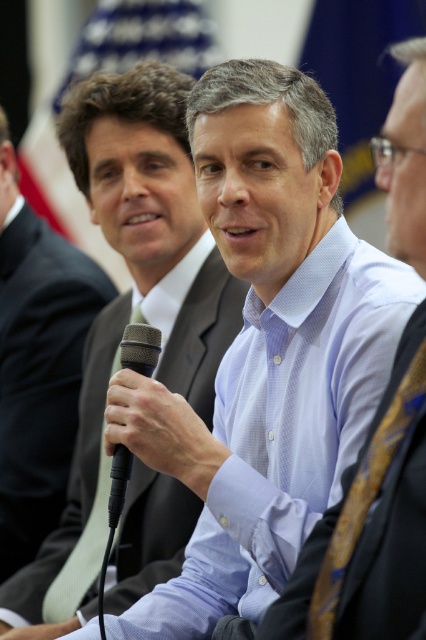
Which is behind, point (34, 509) or point (157, 352)?

Positioned behind is point (34, 509).

Between matte black microphone at center and black matte microphone at center, which one is positioned higher?

Positioned higher is matte black microphone at center.

Between point (45, 516) and point (120, 470), which one is positioned behind?

The point (45, 516) is behind.

You are a GUI agent. You are given a task and a screenshot of the screen. Output one action in this format:
    pyautogui.click(x=<x>, y=<y>)
    Task: Click on the matte black microphone at center
    
    Given the screenshot: What is the action you would take?
    (x=37, y=364)

Can you confirm if dark gray suit at center is positioned to the right of matte black microphone at center?

Correct, you'll find dark gray suit at center to the right of matte black microphone at center.

Is point (46, 554) positioned before point (42, 540)?

Yes, it is.

Which is in front, point (206, 310) or point (49, 396)?

Point (206, 310) is in front.

The width and height of the screenshot is (426, 640). Find the location of `dark gray suit at center`. dark gray suit at center is located at coordinates click(195, 326).

Which is more to the left, light blue textured shirt at center or matte black microphone at center?

From the viewer's perspective, matte black microphone at center appears more on the left side.

Between light blue textured shirt at center and matte black microphone at center, which one has less height?

light blue textured shirt at center is shorter.

The height and width of the screenshot is (640, 426). What are the coordinates of `light blue textured shirt at center` in the screenshot? It's located at (370, 525).

Where is `light blue textured shirt at center`? Image resolution: width=426 pixels, height=640 pixels. light blue textured shirt at center is located at coordinates (370, 525).